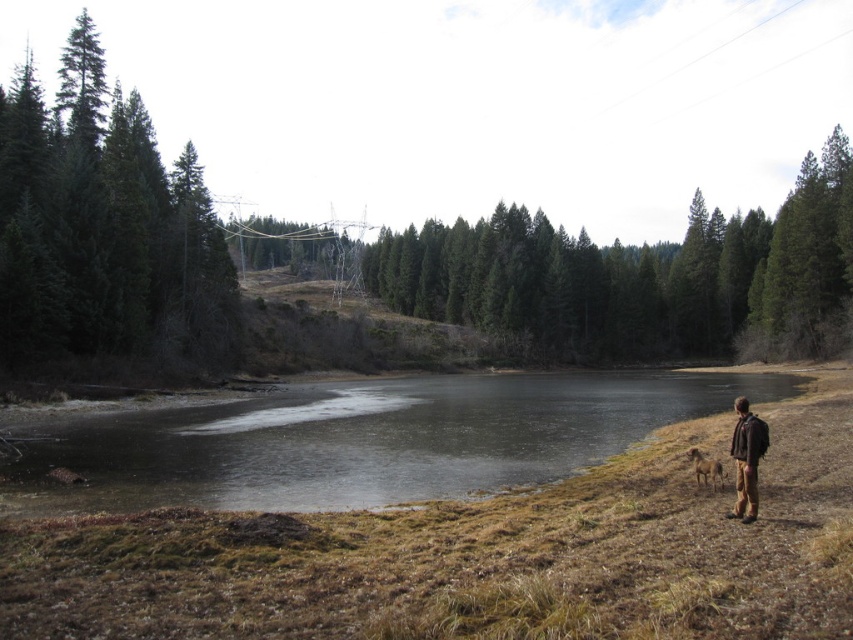
You are a hiker who wants to retrieve your brown leather jacket at lower right from the scene. However, there is frozen ice at lower center in your path. Can you reach your jacket without stepping on the ice?

The brown leather jacket at lower right is behind the frozen ice at lower center, so you can reach the brown leather jacket at lower right without stepping on the ice by going around it.

You are planning to cross the frozen ice at lower center with your heavy backpack. Considering the size of the brown leather jacket at lower right, can you estimate whether the ice can support your weight?

The frozen ice at lower center is bigger than the brown leather jacket at lower right, but size does not necessarily correlate with thickness or strength. You should not rely solely on the size comparison to determine the ice safety. It is recommended to check the ice thickness properly before stepping on it.

You are standing at the edge of the water and want to place a small marker at the exact center of the frozen ice at lower center. According to the coordinates provided, what are the coordinates where you should place the marker?

The coordinates for the exact center of the frozen ice at lower center are at point [366,440].